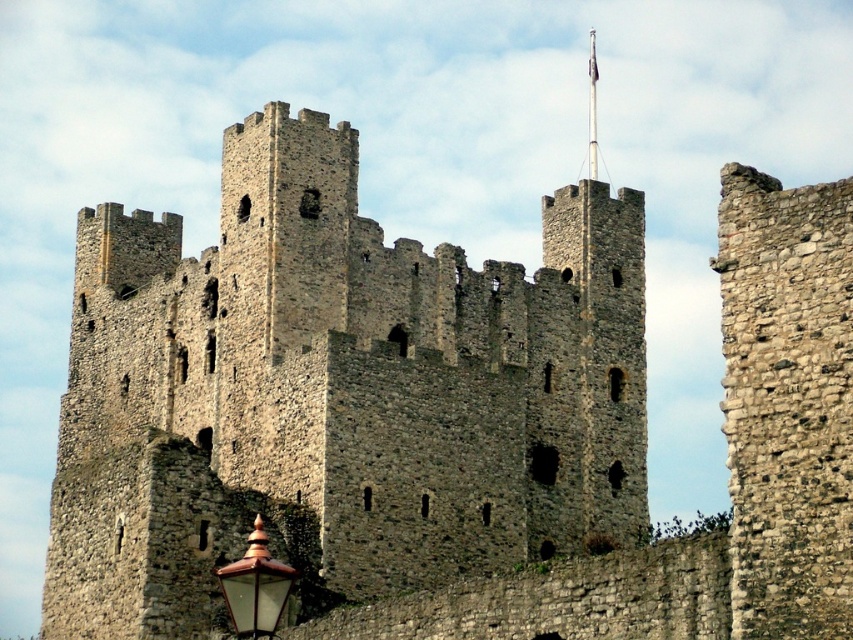
Question: Can you confirm if gray stone castle at center is positioned above polished brass lantern at lower left?

Choices:
 (A) yes
 (B) no

Answer: (A)

Question: Is gray stone castle at center to the right of polished brass lantern at lower left from the viewer's perspective?

Choices:
 (A) no
 (B) yes

Answer: (A)

Question: Which point is closer to the camera?

Choices:
 (A) (271, 614)
 (B) (625, 460)

Answer: (A)

Question: Which object appears farthest from the camera in this image?

Choices:
 (A) gray stone castle at center
 (B) polished brass lantern at lower left

Answer: (A)

Question: Is gray stone castle at center positioned behind polished brass lantern at lower left?

Choices:
 (A) yes
 (B) no

Answer: (A)